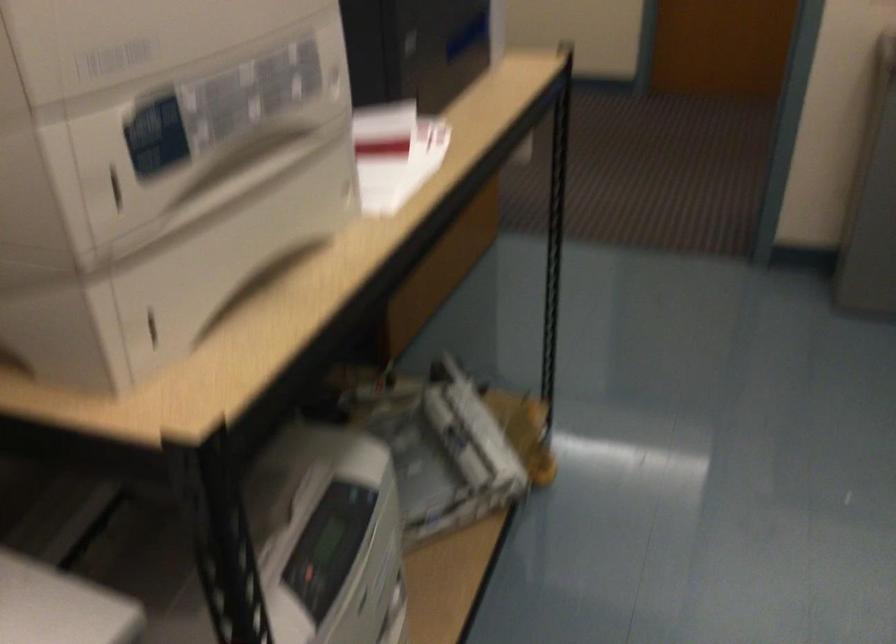
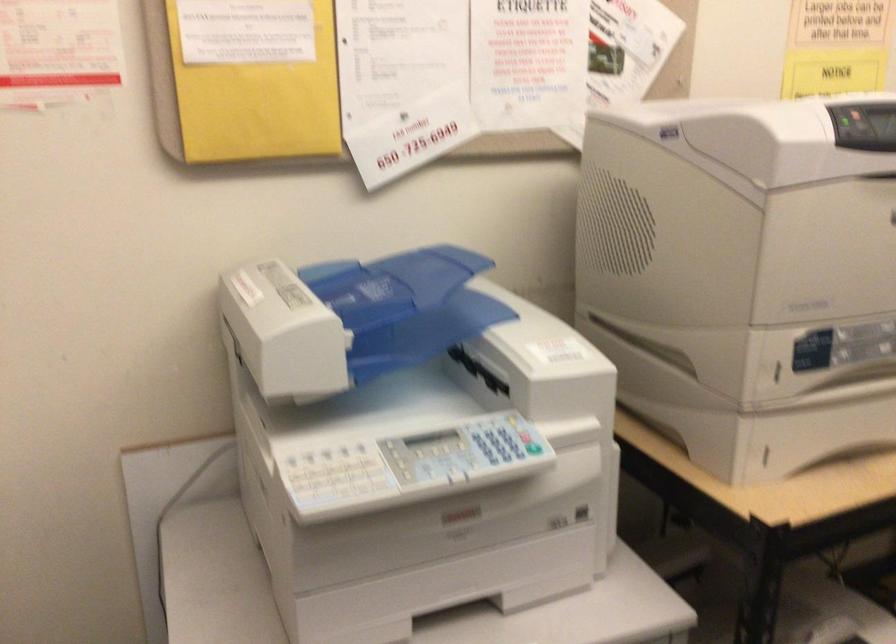
Where in the second image is the point corresponding to point (122, 187) from the first image?

(777, 372)